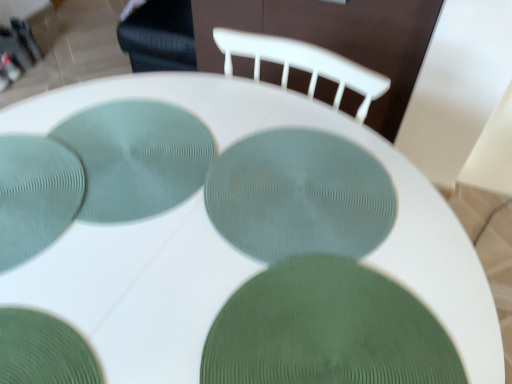
Locate an element on the screen. This screenshot has height=384, width=512. vacant area located to the right-hand side of teal textured placemat at center, the third glass plate viewed from the left is located at coordinates [x=282, y=172].